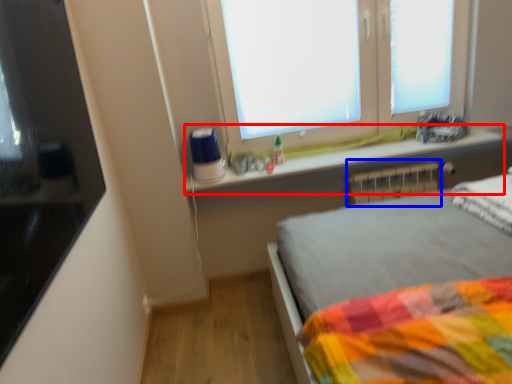
Question: Which of the following is the farthest to the observer, window sill (highlighted by a red box) or radiator (highlighted by a blue box)?

Choices:
 (A) window sill
 (B) radiator

Answer: (B)